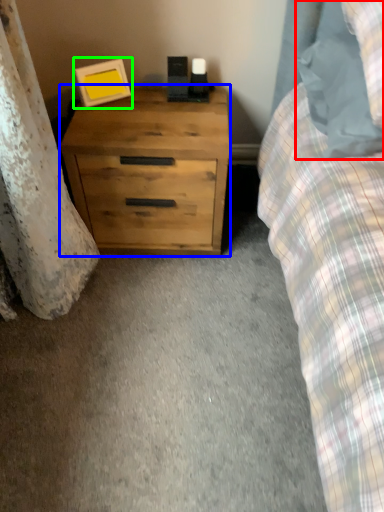
Question: Based on their relative distances, which object is farther from pillow (highlighted by a red box)? Choose from chest of drawers (highlighted by a blue box) and picture frame (highlighted by a green box).

Choices:
 (A) chest of drawers
 (B) picture frame

Answer: (B)